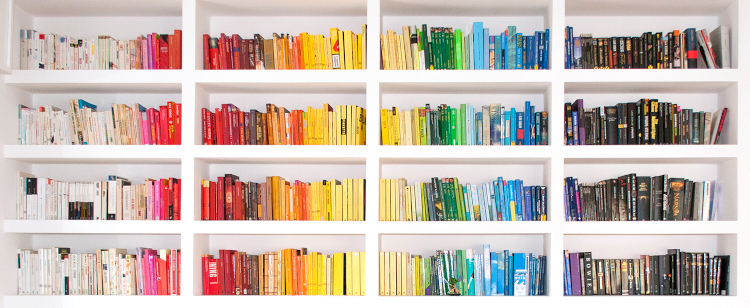
Where is `pink book sections`? The width and height of the screenshot is (750, 308). pink book sections is located at coordinates (162, 37), (168, 121), (168, 201), (168, 263).